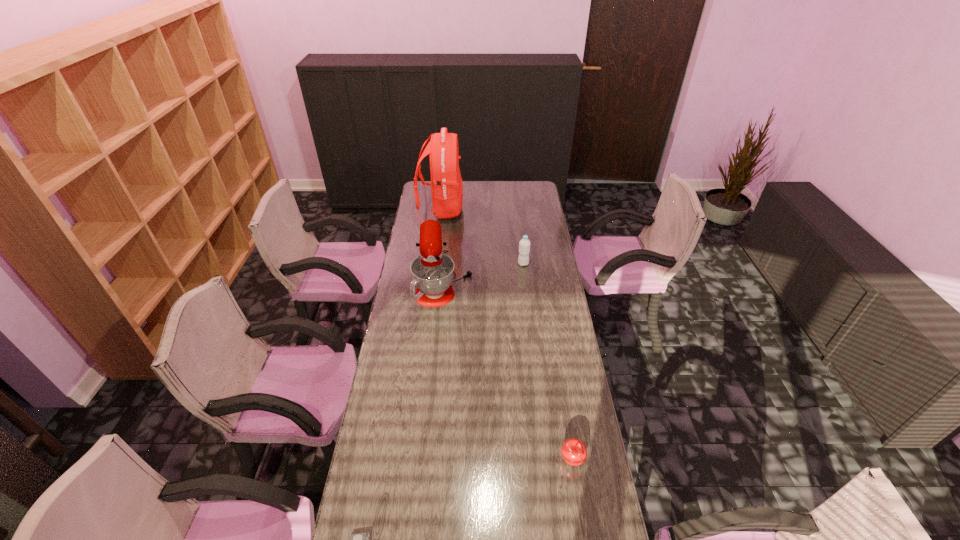
This screenshot has height=540, width=960. I want to click on the tallest object, so click(x=446, y=184).

What are the coordinates of `the farthest object` in the screenshot? It's located at (x=446, y=184).

Where is `the second tallest object`? the second tallest object is located at coordinates (432, 271).

You are a GUI agent. You are given a task and a screenshot of the screen. Output one action in this format:
    pyautogui.click(x=<x>, y=<y>)
    Task: Click on the third tallest object
    Image resolution: width=960 pixels, height=540 pixels.
    Given the screenshot: What is the action you would take?
    pyautogui.click(x=524, y=246)

Identify the location of the fourth object from left to right. (524, 246).

Identify the location of the rightmost object. (574, 452).

Where is `cherry`? Image resolution: width=960 pixels, height=540 pixels. cherry is located at coordinates (574, 452).

Image resolution: width=960 pixels, height=540 pixels. Identify the location of vacant area situated 0.150m on the main compartment of the farthest object. (490, 211).

Identify the location of free region located 0.220m on the bowl side of the mixer. The image size is (960, 540). (518, 279).

Identify the location of vacant space positioned 0.280m on the back of the water bottle. (519, 228).